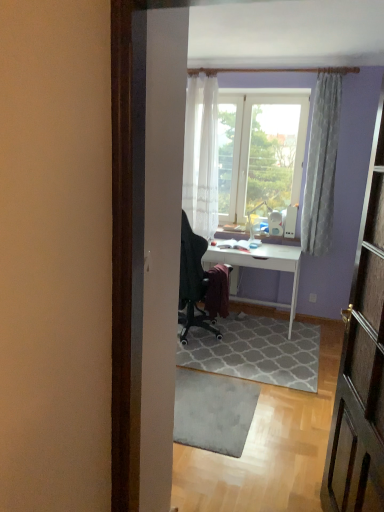
You are a GUI agent. You are given a task and a screenshot of the screen. Output one action in this format:
    pyautogui.click(x=<x>, y=<y>)
    Task: Click on the white glossy desk at center
    The height and width of the screenshot is (512, 384).
    Given the screenshot: What is the action you would take?
    pyautogui.click(x=262, y=264)

This screenshot has height=512, width=384. What do you see at coordinates (256, 351) in the screenshot?
I see `gray textured rug at center, positioned as the 1th doormat in back-to-front order` at bounding box center [256, 351].

This screenshot has height=512, width=384. What are the coordinates of `white glossy desk at center` in the screenshot? It's located at (262, 264).

Can you tell me how much transparent glass window at center and gray textured rug at center, which is the 2th doormat from back to front, differ in facing direction?

179 degrees.

Is transparent glass window at center positioned beyond the bounds of gray textured rug at center, which is the 2th doormat from back to front?

That's correct, transparent glass window at center is outside of gray textured rug at center, which is the 2th doormat from back to front.

Where is `window screen behind the gray textured rug at center, marked as the first doormat in a front-to-back arrangement`? This screenshot has height=512, width=384. window screen behind the gray textured rug at center, marked as the first doormat in a front-to-back arrangement is located at coordinates click(260, 153).

How much distance is there between transparent glass window at center and gray textured rug at center, marked as the first doormat in a front-to-back arrangement?

The distance of transparent glass window at center from gray textured rug at center, marked as the first doormat in a front-to-back arrangement, is 7.68 feet.

Would you consider white textured curtain at upper right, which is the second curtain from left to right, to be distant from white glossy desk at center?

white textured curtain at upper right, which is the second curtain from left to right, is actually quite close to white glossy desk at center.

You are a GUI agent. You are given a task and a screenshot of the screen. Output one action in this format:
    pyautogui.click(x=<x>, y=<y>)
    Task: Click on the desk below the white textured curtain at upper right, which is the second curtain from left to right (from a real-world perspective)
    
    Given the screenshot: What is the action you would take?
    pyautogui.click(x=262, y=264)

Does white textured curtain at upper right, the first curtain positioned from the right, have a lesser height compared to white glossy desk at center?

No, white textured curtain at upper right, the first curtain positioned from the right, is not shorter than white glossy desk at center.

In the scene shown: Between white textured curtain at upper right, the first curtain positioned from the right, and gray textured rug at center, the 2th doormat positioned from the front, which one has larger width?

With larger width is gray textured rug at center, the 2th doormat positioned from the front.

Is white textured curtain at upper right, the first curtain positioned from the right, shorter than gray textured rug at center, the 2th doormat positioned from the front?

Incorrect, the height of white textured curtain at upper right, the first curtain positioned from the right, does not fall short of that of gray textured rug at center, the 2th doormat positioned from the front.

This screenshot has height=512, width=384. There is a gray textured rug at center, positioned as the 1th doormat in back-to-front order. In order to click on the 1st curtain above it (from a real-world perspective) in this screenshot , I will do `click(321, 166)`.

Is white textured curtain at upper right, which is the second curtain from left to right, located outside gray textured rug at center, the 2th doormat positioned from the front?

Yes, white textured curtain at upper right, which is the second curtain from left to right, is not within gray textured rug at center, the 2th doormat positioned from the front.

Is gray textured rug at center, which is the 2th doormat from back to front, next to white sheer curtain at upper center, which appears as the 1th curtain when viewed from the left, and touching it?

No, gray textured rug at center, which is the 2th doormat from back to front, is not making contact with white sheer curtain at upper center, which appears as the 1th curtain when viewed from the left.

From the image's perspective, starting from the white sheer curtain at upper center, which appears as the 1th curtain when viewed from the left, which doormat is the 2nd one below? Please provide its 2D coordinates.

[(213, 411)]

Which is correct: gray textured rug at center, marked as the first doormat in a front-to-back arrangement, is inside white sheer curtain at upper center, which appears as the 1th curtain when viewed from the left, or outside of it?

gray textured rug at center, marked as the first doormat in a front-to-back arrangement, is located beyond the bounds of white sheer curtain at upper center, which appears as the 1th curtain when viewed from the left.

Which is behind, point (239, 441) or point (199, 197)?

The point (199, 197) is farther.

Considering the sizes of objects gray textured rug at center, marked as the first doormat in a front-to-back arrangement, and white glossy desk at center in the image provided, who is taller, gray textured rug at center, marked as the first doormat in a front-to-back arrangement, or white glossy desk at center?

white glossy desk at center.

Do you think gray textured rug at center, which is the 2th doormat from back to front, is within white glossy desk at center, or outside of it?

gray textured rug at center, which is the 2th doormat from back to front, lies outside white glossy desk at center.

Which is more to the left, gray textured rug at center, which is the 2th doormat from back to front, or white glossy desk at center?

Positioned to the left is gray textured rug at center, which is the 2th doormat from back to front.

Is gray textured rug at center, the 2th doormat positioned from the front, turned away from white sheer curtain at upper center, positioned as the second curtain in right-to-left order?

No.

How far apart are gray textured rug at center, the 2th doormat positioned from the front, and white sheer curtain at upper center, positioned as the second curtain in right-to-left order?

gray textured rug at center, the 2th doormat positioned from the front, and white sheer curtain at upper center, positioned as the second curtain in right-to-left order, are 5.28 feet apart.

From the picture: Between gray textured rug at center, positioned as the 1th doormat in back-to-front order, and white sheer curtain at upper center, positioned as the second curtain in right-to-left order, which one has larger size?

With larger size is white sheer curtain at upper center, positioned as the second curtain in right-to-left order.

Between point (236, 362) and point (206, 222), which one is positioned behind?

The point (206, 222) is more distant.

How much distance is there between white glossy desk at center and gray textured rug at center, the 2th doormat positioned from the front?

The distance of white glossy desk at center from gray textured rug at center, the 2th doormat positioned from the front, is 23.21 inches.

Identify the location of desk on the left of gray textured rug at center, the 2th doormat positioned from the front. Image resolution: width=384 pixels, height=512 pixels. point(262,264).

In terms of width, does white glossy desk at center look wider or thinner when compared to gray textured rug at center, the 2th doormat positioned from the front?

Considering their sizes, white glossy desk at center looks slimmer than gray textured rug at center, the 2th doormat positioned from the front.

From the image's perspective, is white glossy desk at center located beneath gray textured rug at center, positioned as the 1th doormat in back-to-front order?

No, from the image's perspective, white glossy desk at center is not beneath gray textured rug at center, positioned as the 1th doormat in back-to-front order.

Identify the location of window screen lying on the right of gray textured rug at center, which is the 2th doormat from back to front. (260, 153).

Locate an element on the screen. desk beneath the white textured curtain at upper right, which is the second curtain from left to right (from a real-world perspective) is located at coordinates (262, 264).

When comparing their distances from gray textured rug at center, marked as the first doormat in a front-to-back arrangement, does white sheer curtain at upper center, positioned as the second curtain in right-to-left order, or gray textured rug at center, positioned as the 1th doormat in back-to-front order, seem closer?

Based on the image, gray textured rug at center, positioned as the 1th doormat in back-to-front order, appears to be nearer to gray textured rug at center, marked as the first doormat in a front-to-back arrangement.

Based on their spatial positions, is gray textured rug at center, positioned as the 1th doormat in back-to-front order, or transparent glass window at center closer to white sheer curtain at upper center, which appears as the 1th curtain when viewed from the left?

transparent glass window at center.

Consider the image. Estimate the real-world distances between objects in this image. Which object is closer to gray textured rug at center, the 2th doormat positioned from the front, white glossy desk at center or gray textured rug at center, which is the 2th doormat from back to front?

Among the two, gray textured rug at center, which is the 2th doormat from back to front, is located nearer to gray textured rug at center, the 2th doormat positioned from the front.

Which object lies nearer to the anchor point white sheer curtain at upper center, positioned as the second curtain in right-to-left order, gray textured rug at center, marked as the first doormat in a front-to-back arrangement, or white glossy desk at center?

white glossy desk at center lies closer to white sheer curtain at upper center, positioned as the second curtain in right-to-left order, than the other object.

Looking at the image, which one is located further to white glossy desk at center, white textured curtain at upper right, the first curtain positioned from the right, or gray textured rug at center, marked as the first doormat in a front-to-back arrangement?

gray textured rug at center, marked as the first doormat in a front-to-back arrangement, is further to white glossy desk at center.

Estimate the real-world distances between objects in this image. Which object is closer to gray textured rug at center, which is the 2th doormat from back to front, white textured curtain at upper right, the first curtain positioned from the right, or white glossy desk at center?

white glossy desk at center is closer to gray textured rug at center, which is the 2th doormat from back to front.

Based on the photo, considering their positions, is gray textured rug at center, positioned as the 1th doormat in back-to-front order, positioned further to white glossy desk at center than transparent glass window at center?

Among the two, transparent glass window at center is located further to white glossy desk at center.

Estimate the real-world distances between objects in this image. Which object is closer to gray textured rug at center, marked as the first doormat in a front-to-back arrangement, gray textured rug at center, the 2th doormat positioned from the front, or white textured curtain at upper right, which is the second curtain from left to right?

gray textured rug at center, the 2th doormat positioned from the front, lies closer to gray textured rug at center, marked as the first doormat in a front-to-back arrangement, than the other object.

You are a GUI agent. You are given a task and a screenshot of the screen. Output one action in this format:
    pyautogui.click(x=<x>, y=<y>)
    Task: Click on the desk between white sheer curtain at upper center, positioned as the second curtain in right-to-left order, and gray textured rug at center, the 2th doormat positioned from the front, in the vertical direction
    
    Given the screenshot: What is the action you would take?
    pyautogui.click(x=262, y=264)

This screenshot has width=384, height=512. I want to click on curtain that lies between white sheer curtain at upper center, which appears as the 1th curtain when viewed from the left, and gray textured rug at center, the 2th doormat positioned from the front, from top to bottom, so click(x=321, y=166).

Identify the location of curtain between white sheer curtain at upper center, positioned as the second curtain in right-to-left order, and gray textured rug at center, which is the 2th doormat from back to front, from top to bottom. (321, 166).

Find the location of `doormat between white sheer curtain at upper center, positioned as the second curtain in right-to-left order, and gray textured rug at center, marked as the first doormat in a front-to-back arrangement, in the up-down direction`. doormat between white sheer curtain at upper center, positioned as the second curtain in right-to-left order, and gray textured rug at center, marked as the first doormat in a front-to-back arrangement, in the up-down direction is located at coordinates click(256, 351).